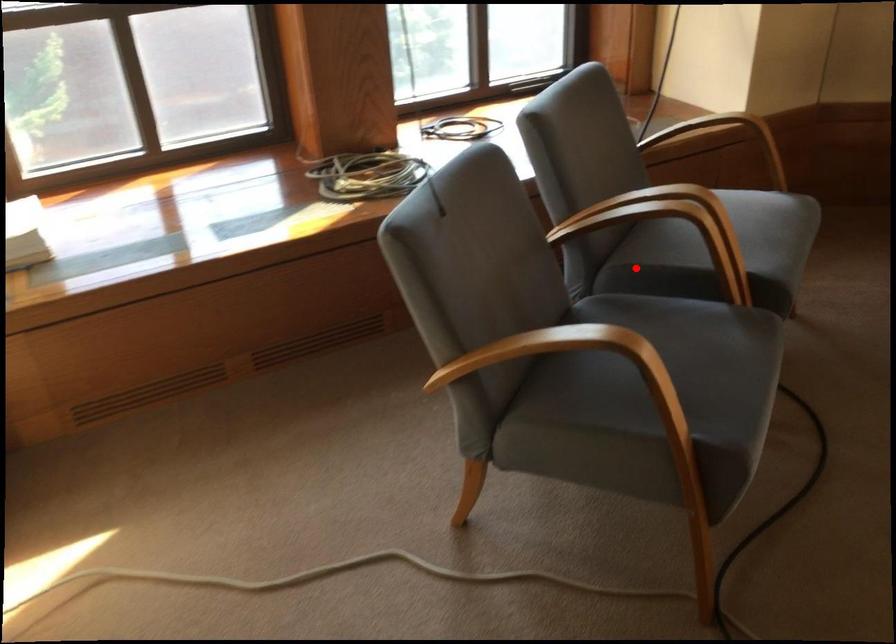
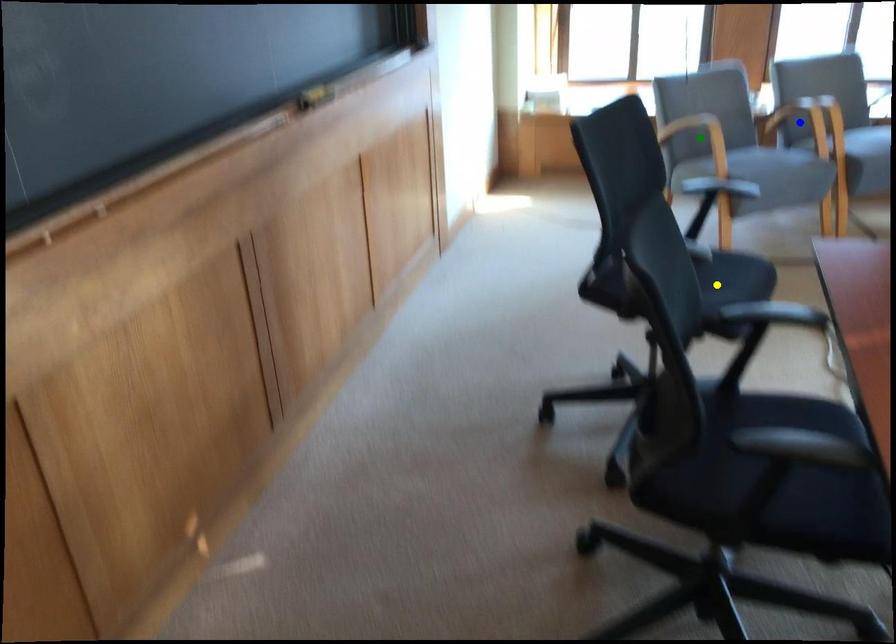
Question: I am providing you with two images of the same scene from different viewpoints. A red point is marked on the first image. You are given multiple points on the second image. Which mark in image 2 goes with the point in image 1?

Choices:
 (A) yellow point
 (B) green point
 (C) blue point

Answer: (C)